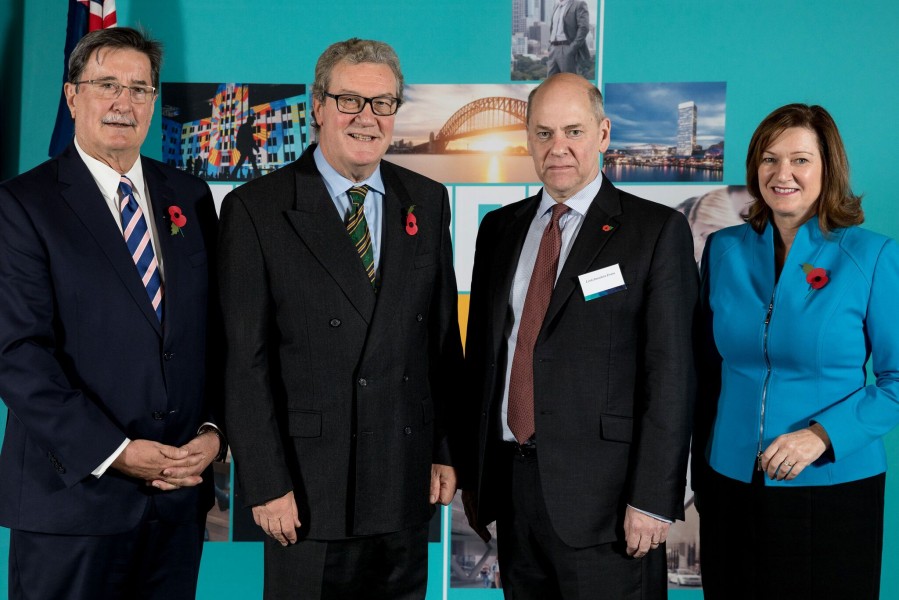
What are the coordinates of `turquoise painted wall` in the screenshot? It's located at (715, 28), (227, 27), (38, 36).